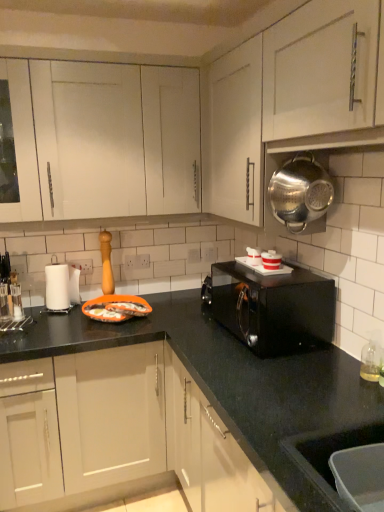
The image size is (384, 512). I want to click on free location in front of white glossy microwave at upper right, positioned as the 2th appliance in right-to-left order, so click(278, 281).